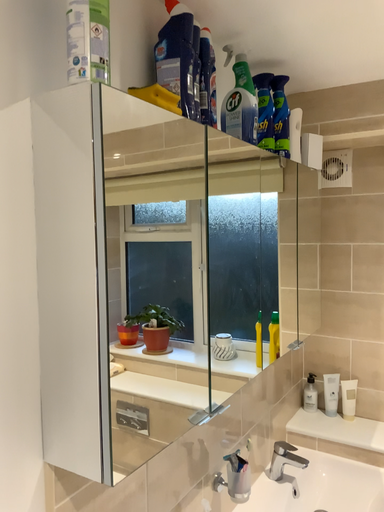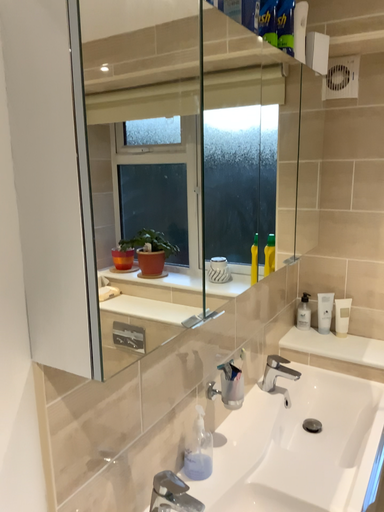
Question: Which way did the camera rotate in the video?

Choices:
 (A) rotated upward
 (B) rotated downward

Answer: (B)